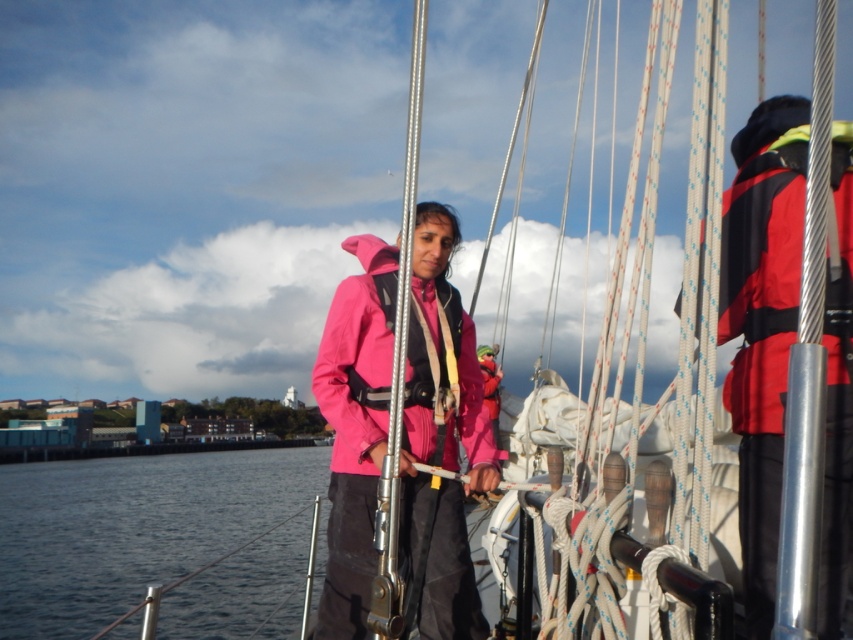
You are a sailor on the deck of a boat and need to identify which jacket is smaller between the red synthetic jacket at right and the matte pink jacket at center. Which one is smaller?

The red synthetic jacket at right is smaller compared to the matte pink jacket at center according to the description.

You are on a sailboat and need to secure a rope to a point closer to you. Which point should you choose between point (161, 516) and point (798, 246)?

Point (161, 516) is further to the viewer than point (798, 246), so you should choose point (161, 516) to secure the rope since it is closer to you.